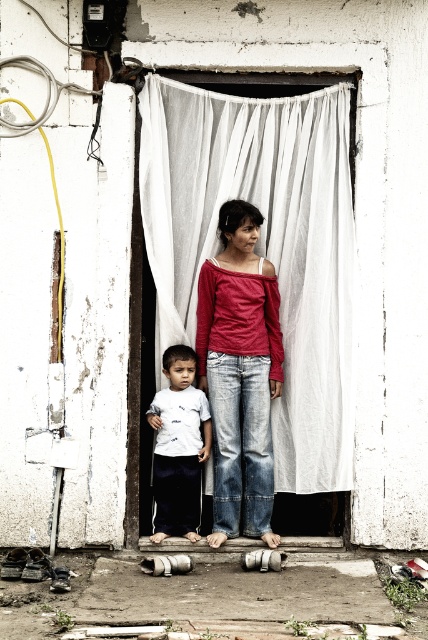
You are a photographer trying to capture both children in a single frame. Since the matte red shirt at center and white matte shirt at center are both at the center, which child should you adjust to ensure both are fully visible in the photo?

The matte red shirt at center is taller than the white matte shirt at center. To ensure both are fully visible, you should lower the camera angle slightly so that the taller child with the matte red shirt at center doesn

You are a delivery person holding a package that requires a 10 meter clearance to deliver safely. You need to pass between the two points marked as point (262,152) and another point. Can you safely navigate through this space with the package?

The distance between the two points marked as point (262,152) is 8.42 meters, which is less than the required 10 meter clearance. Therefore, you cannot safely navigate through this space with the package.

You are a parent trying to dress your child in the white matte shirt at center. The child is standing under the white sheer curtain at center. Can you easily put the shirt on the child without the curtain getting in the way?

The white sheer curtain at center is above the white matte shirt at center, so the curtain is positioned higher than the shirt. Since the curtain is above, it should not interfere with putting the shirt on the child.